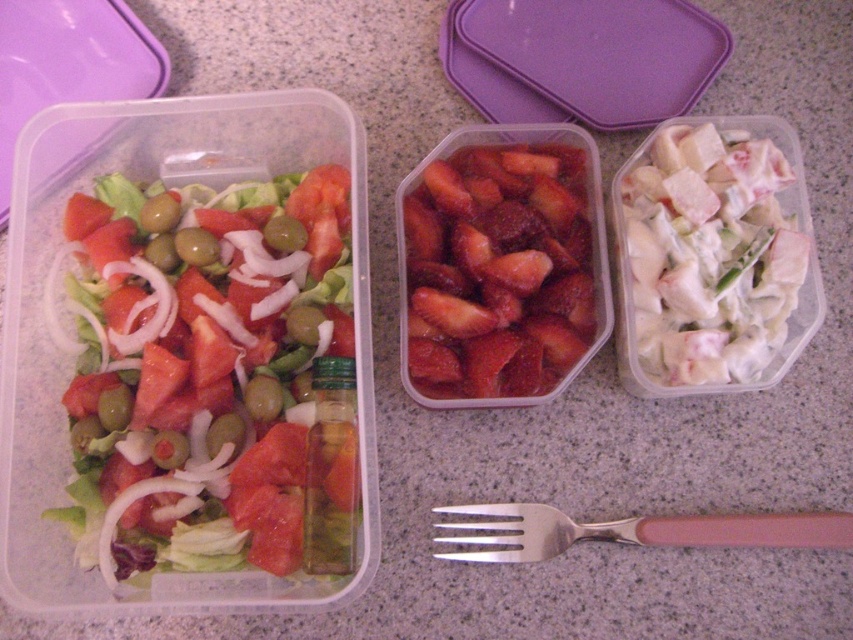
Question: Which point is closer to the camera taking this photo?

Choices:
 (A) (727, 148)
 (B) (163, 352)
 (C) (457, 268)
 (D) (695, 528)

Answer: (B)

Question: Estimate the real-world distances between objects in this image. Which object is farther from the silver metallic fork at center?

Choices:
 (A) shiny red strawberries at center
 (B) fresh green salad at left

Answer: (B)

Question: Is white creamy chicken salad at right bigger than shiny red strawberries at center?

Choices:
 (A) no
 (B) yes

Answer: (B)

Question: Among these points, which one is farthest from the camera?

Choices:
 (A) (323, 545)
 (B) (648, 193)

Answer: (B)

Question: Does fresh green salad at left have a smaller size compared to white creamy chicken salad at right?

Choices:
 (A) yes
 (B) no

Answer: (B)

Question: Is fresh green salad at left below shiny red strawberries at center?

Choices:
 (A) no
 (B) yes

Answer: (B)